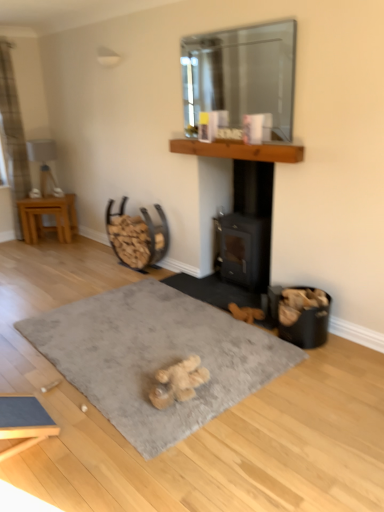
Locate an element on the screen. The height and width of the screenshot is (512, 384). vacant space in front of fuzzy beige teddy bear at center is located at coordinates (180, 421).